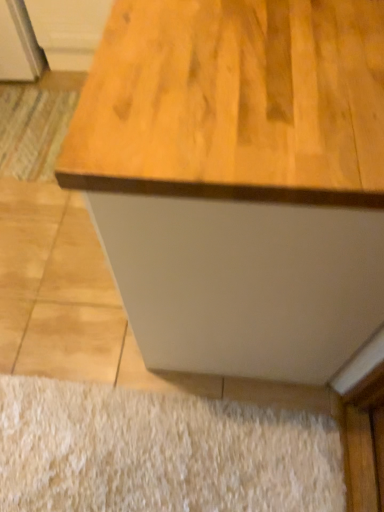
In order to face wooden cabinet at upper left, should I rotate leftwards or rightwards?

A 13.495 degree turn to the left will do.

Locate an element on the screen. This screenshot has width=384, height=512. white shaggy rug at lower center, which is the second doormat from back to front is located at coordinates (159, 452).

Measure the distance from white shaggy rug at lower center, acting as the first doormat starting from the right, to wooden cabinet at upper left.

white shaggy rug at lower center, acting as the first doormat starting from the right, and wooden cabinet at upper left are 5.51 feet apart.

From the image's perspective, between white shaggy rug at lower center, which is the second doormat from back to front, and wooden cabinet at upper left, which one is located above?

From the image's view, wooden cabinet at upper left is above.

Is white shaggy rug at lower center, arranged as the 1th doormat when ordered from the bottom, wider or thinner than wooden cabinet at upper left?

Clearly, white shaggy rug at lower center, arranged as the 1th doormat when ordered from the bottom, has less width compared to wooden cabinet at upper left.

I want to click on the 2nd doormat below the wooden cabinet at upper left (from the image's perspective), so click(x=159, y=452).

Is point (46, 23) positioned in front of point (262, 409)?

No, (46, 23) is further to viewer.

Which is correct: wooden cabinet at upper left is inside white shaggy rug at lower center, arranged as the second doormat when viewed from the left, or outside of it?

wooden cabinet at upper left is not inside white shaggy rug at lower center, arranged as the second doormat when viewed from the left, it's outside.

Can you confirm if wooden cabinet at upper left is taller than white shaggy rug at lower center, which is the 2th doormat in top-to-bottom order?

Correct, wooden cabinet at upper left is much taller as white shaggy rug at lower center, which is the 2th doormat in top-to-bottom order.

Are wooden cabinet at upper left and white shaggy rug at lower center, which is the 2th doormat in top-to-bottom order, making contact?

wooden cabinet at upper left and white shaggy rug at lower center, which is the 2th doormat in top-to-bottom order, are not in contact.

How much distance is there between white shaggy rug at lower center, arranged as the 1th doormat when ordered from the bottom, and striped fabric doormat at lower left, placed as the first doormat when sorted from top to bottom?

They are 1.17 meters apart.

Does white shaggy rug at lower center, arranged as the second doormat when viewed from the left, have a smaller size compared to striped fabric doormat at lower left, which ranks as the first doormat in left-to-right order?

Actually, white shaggy rug at lower center, arranged as the second doormat when viewed from the left, might be larger than striped fabric doormat at lower left, which ranks as the first doormat in left-to-right order.

Image resolution: width=384 pixels, height=512 pixels. In order to click on doormat beneath the white shaggy rug at lower center, arranged as the second doormat when viewed from the left (from a real-world perspective) in this screenshot , I will do (33, 129).

Considering the relative sizes of white shaggy rug at lower center, arranged as the 1th doormat when ordered from the bottom, and striped fabric doormat at lower left, placed as the second doormat when sorted from bottom to top, in the image provided, is white shaggy rug at lower center, arranged as the 1th doormat when ordered from the bottom, thinner than striped fabric doormat at lower left, placed as the second doormat when sorted from bottom to top,?

Indeed, white shaggy rug at lower center, arranged as the 1th doormat when ordered from the bottom, has a lesser width compared to striped fabric doormat at lower left, placed as the second doormat when sorted from bottom to top.

Which of these two, striped fabric doormat at lower left, placed as the second doormat when sorted from bottom to top, or white shaggy rug at lower center, which is the second doormat from back to front, is wider?

Wider between the two is striped fabric doormat at lower left, placed as the second doormat when sorted from bottom to top.

Considering their positions, is striped fabric doormat at lower left, arranged as the 2th doormat when viewed from the right, located in front of or behind white shaggy rug at lower center, which is the 2th doormat in top-to-bottom order?

striped fabric doormat at lower left, arranged as the 2th doormat when viewed from the right, is behind white shaggy rug at lower center, which is the 2th doormat in top-to-bottom order.

Is point (38, 177) less distant than point (12, 384)?

That is False.

From their relative heights in the image, would you say striped fabric doormat at lower left, placed as the second doormat when sorted from bottom to top, is taller or shorter than white shaggy rug at lower center, which is the 2th doormat in top-to-bottom order?

In the image, striped fabric doormat at lower left, placed as the second doormat when sorted from bottom to top, appears to be shorter than white shaggy rug at lower center, which is the 2th doormat in top-to-bottom order.

Can you confirm if wooden cabinet at upper left is bigger than striped fabric doormat at lower left, acting as the second doormat starting from the front?

Yes.

Considering the sizes of objects wooden cabinet at upper left and striped fabric doormat at lower left, placed as the second doormat when sorted from bottom to top, in the image provided, who is thinner, wooden cabinet at upper left or striped fabric doormat at lower left, placed as the second doormat when sorted from bottom to top,?

Thinner between the two is striped fabric doormat at lower left, placed as the second doormat when sorted from bottom to top.

From the picture: Is wooden cabinet at upper left inside the boundaries of striped fabric doormat at lower left, which ranks as the first doormat in left-to-right order, or outside?

wooden cabinet at upper left is located beyond the bounds of striped fabric doormat at lower left, which ranks as the first doormat in left-to-right order.

Who is taller, wooden cabinet at upper left or striped fabric doormat at lower left, placed as the first doormat when sorted from top to bottom?

wooden cabinet at upper left.

From the image's perspective, who appears lower, striped fabric doormat at lower left, placed as the first doormat when sorted from top to bottom, or wooden cabinet at upper left?

striped fabric doormat at lower left, placed as the first doormat when sorted from top to bottom.

Is striped fabric doormat at lower left, arranged as the 2th doormat when viewed from the right, oriented away from wooden cabinet at upper left?

Yes, striped fabric doormat at lower left, arranged as the 2th doormat when viewed from the right, is positioned with its back facing wooden cabinet at upper left.

Which of these two, striped fabric doormat at lower left, which ranks as the first doormat in left-to-right order, or wooden cabinet at upper left, is thinner?

striped fabric doormat at lower left, which ranks as the first doormat in left-to-right order.

Is striped fabric doormat at lower left, marked as the 1th doormat in a back-to-front arrangement, far away from wooden cabinet at upper left?

No, striped fabric doormat at lower left, marked as the 1th doormat in a back-to-front arrangement, is not far from wooden cabinet at upper left.

Image resolution: width=384 pixels, height=512 pixels. In order to click on cabinetry located above the white shaggy rug at lower center, arranged as the 1th doormat when ordered from the bottom (from a real-world perspective) in this screenshot , I will do `click(68, 30)`.

The width and height of the screenshot is (384, 512). In order to click on cabinetry that appears behind the white shaggy rug at lower center, arranged as the 1th doormat when viewed from the front in this screenshot , I will do `click(68, 30)`.

Looking at the image, which one is located further to striped fabric doormat at lower left, marked as the 1th doormat in a back-to-front arrangement, white shaggy rug at lower center, arranged as the 1th doormat when viewed from the front, or wooden cabinet at upper left?

white shaggy rug at lower center, arranged as the 1th doormat when viewed from the front, is positioned further to the anchor striped fabric doormat at lower left, marked as the 1th doormat in a back-to-front arrangement.

When comparing their distances from wooden cabinet at upper left, does white shaggy rug at lower center, which is the second doormat from back to front, or striped fabric doormat at lower left, arranged as the 2th doormat when viewed from the right, seem further?

Based on the image, white shaggy rug at lower center, which is the second doormat from back to front, appears to be further to wooden cabinet at upper left.

Looking at the image, which one is located further to white shaggy rug at lower center, which is the second doormat from back to front, wooden cabinet at upper left or striped fabric doormat at lower left, marked as the 1th doormat in a back-to-front arrangement?

The object further to white shaggy rug at lower center, which is the second doormat from back to front, is wooden cabinet at upper left.

When comparing their distances from wooden cabinet at upper left, does striped fabric doormat at lower left, acting as the second doormat starting from the front, or white shaggy rug at lower center, which is the second doormat from back to front, seem further?

Based on the image, white shaggy rug at lower center, which is the second doormat from back to front, appears to be further to wooden cabinet at upper left.

Estimate the real-world distances between objects in this image. Which object is closer to white shaggy rug at lower center, which is the second doormat from back to front, striped fabric doormat at lower left, placed as the first doormat when sorted from top to bottom, or wooden cabinet at upper left?

Among the two, striped fabric doormat at lower left, placed as the first doormat when sorted from top to bottom, is located nearer to white shaggy rug at lower center, which is the second doormat from back to front.

Considering their positions, is wooden cabinet at upper left positioned closer to striped fabric doormat at lower left, marked as the 1th doormat in a back-to-front arrangement, than white shaggy rug at lower center, which is the second doormat from back to front?

wooden cabinet at upper left is positioned closer to the anchor striped fabric doormat at lower left, marked as the 1th doormat in a back-to-front arrangement.

Image resolution: width=384 pixels, height=512 pixels. In order to click on doormat that lies between wooden cabinet at upper left and white shaggy rug at lower center, arranged as the 1th doormat when ordered from the bottom, from top to bottom in this screenshot , I will do `click(33, 129)`.